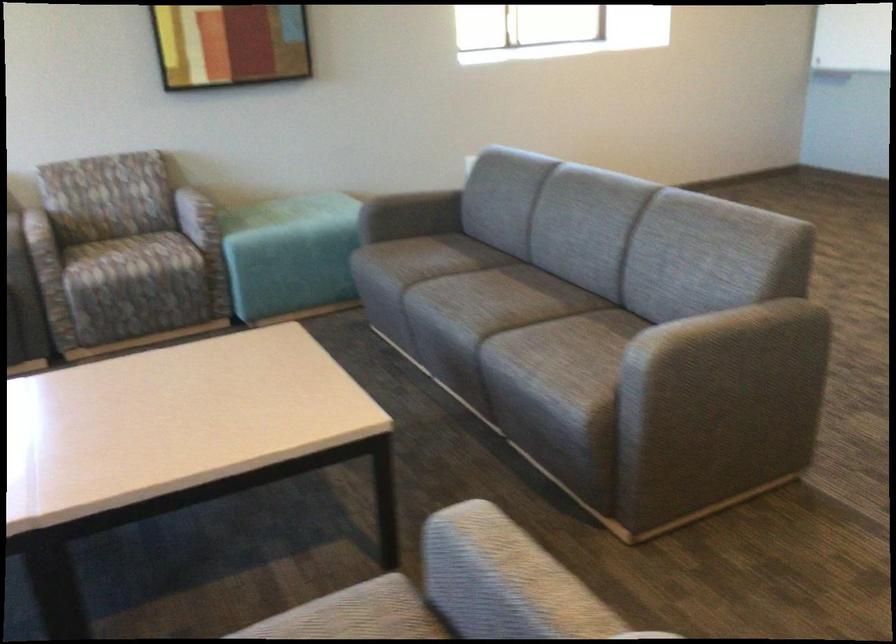
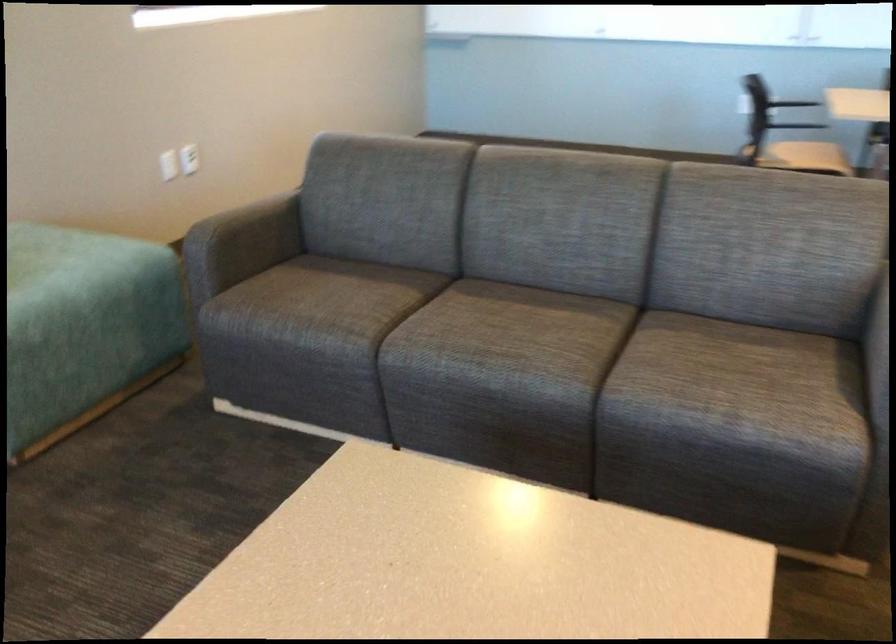
The point at (401, 211) is marked in the first image. Where is the corresponding point in the second image?

(243, 240)